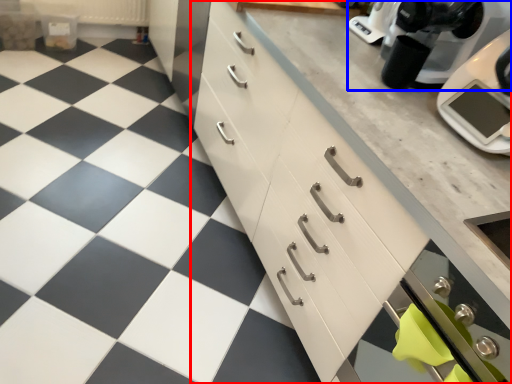
Question: Which object is closer to the camera taking this photo, cabinetry (highlighted by a red box) or kitchen appliance (highlighted by a blue box)?

Choices:
 (A) cabinetry
 (B) kitchen appliance

Answer: (A)